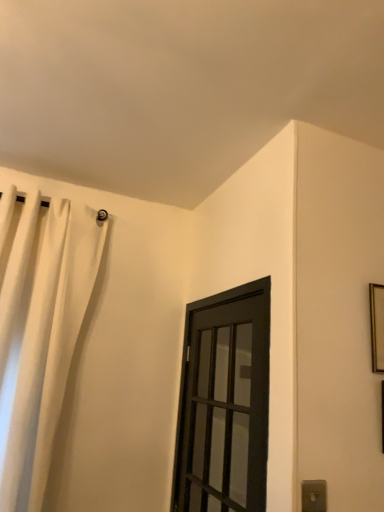
Question: Is white fabric curtain at upper left at the back of gold metallic picture frame at upper right?

Choices:
 (A) yes
 (B) no

Answer: (B)

Question: Does gold metallic picture frame at upper right have a larger size compared to white fabric curtain at upper left?

Choices:
 (A) no
 (B) yes

Answer: (A)

Question: Are gold metallic picture frame at upper right and white fabric curtain at upper left far apart?

Choices:
 (A) yes
 (B) no

Answer: (A)

Question: From the image's perspective, is gold metallic picture frame at upper right on white fabric curtain at upper left?

Choices:
 (A) no
 (B) yes

Answer: (B)

Question: Can you confirm if gold metallic picture frame at upper right is taller than white fabric curtain at upper left?

Choices:
 (A) yes
 (B) no

Answer: (B)

Question: Based on their sizes in the image, would you say gray plastic electric outlet at lower right is bigger or smaller than white fabric curtain at upper left?

Choices:
 (A) big
 (B) small

Answer: (B)

Question: Is gray plastic electric outlet at lower right wider or thinner than white fabric curtain at upper left?

Choices:
 (A) thin
 (B) wide

Answer: (A)

Question: Considering the relative positions of gray plastic electric outlet at lower right and white fabric curtain at upper left in the image provided, is gray plastic electric outlet at lower right to the left or to the right of white fabric curtain at upper left?

Choices:
 (A) left
 (B) right

Answer: (B)

Question: Is point (324, 499) positioned closer to the camera than point (16, 442)?

Choices:
 (A) closer
 (B) farther

Answer: (A)

Question: From a real-world perspective, is gray plastic electric outlet at lower right physically located above or below black matte door at center?

Choices:
 (A) above
 (B) below

Answer: (B)

Question: From the image's perspective, relative to black matte door at center, is gray plastic electric outlet at lower right above or below?

Choices:
 (A) below
 (B) above

Answer: (A)

Question: Considering the positions of gray plastic electric outlet at lower right and black matte door at center in the image, is gray plastic electric outlet at lower right bigger or smaller than black matte door at center?

Choices:
 (A) small
 (B) big

Answer: (A)

Question: Relative to black matte door at center, is gray plastic electric outlet at lower right in front or behind?

Choices:
 (A) behind
 (B) front

Answer: (B)

Question: From their relative heights in the image, would you say black matte door at center is taller or shorter than white fabric curtain at upper left?

Choices:
 (A) tall
 (B) short

Answer: (B)

Question: Is point (230, 396) positioned closer to the camera than point (44, 293)?

Choices:
 (A) closer
 (B) farther

Answer: (A)